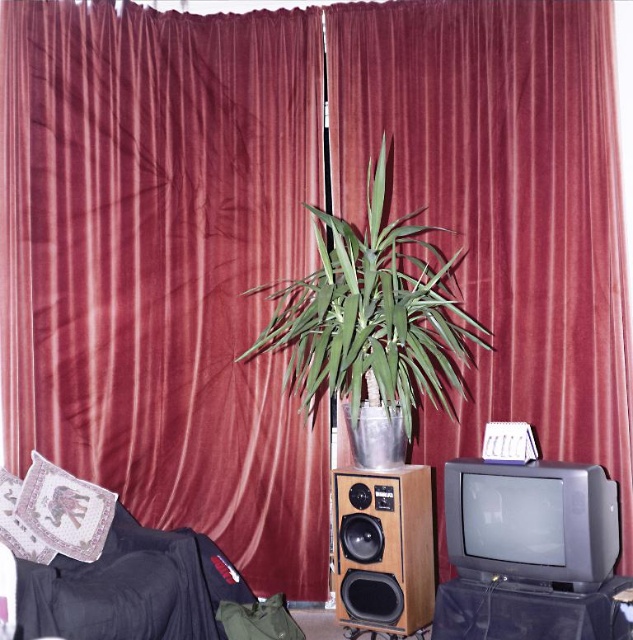
Based on the photo, you are arranging a living room and want to place the embroidered fabric pillow at lower left and the patterned fabric pillow at left. Which pillow should you place higher up to ensure they look balanced?

The embroidered fabric pillow at lower left is much taller than the patterned fabric pillow at left, so placing it lower will create a balanced appearance.

You are setting up a home theater system and need to place a new subwoofer between the matte black television at lower right and the wooden speaker at center. According to the scene, where should you position the subwoofer?

The matte black television at lower right is above the wooden speaker at center, so the subwoofer should be placed between them in the space below the television and above the speaker.

You are setting up a home theater system and need to place a new DVD player that requires 20 inches of space. You have two options in the scene, the matte black television at lower right and the wooden speaker at center. Which object provides enough space for the DVD player?

The matte black television at lower right has a larger size compared to the wooden speaker at center, so it can provide enough space for the DVD player requiring 20 inches of space.